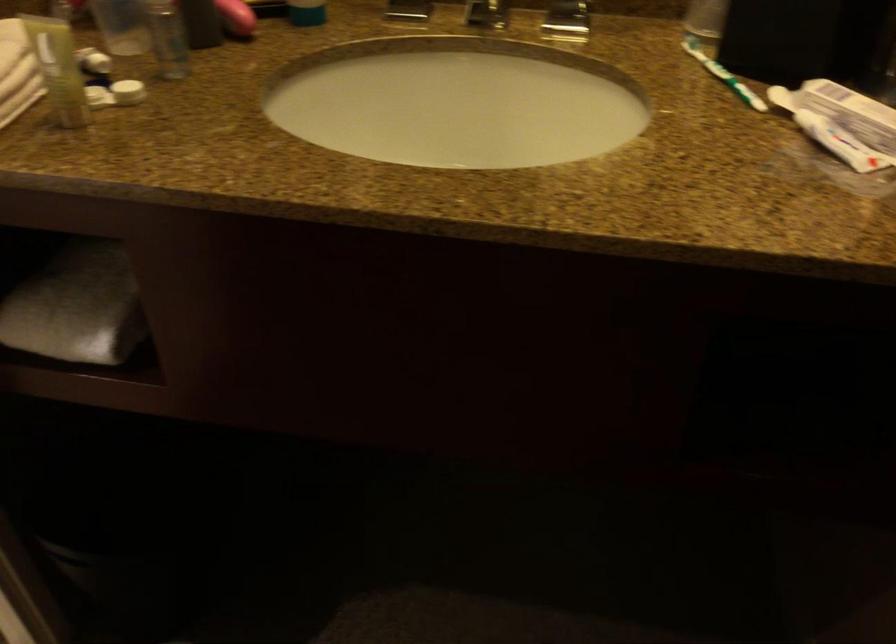
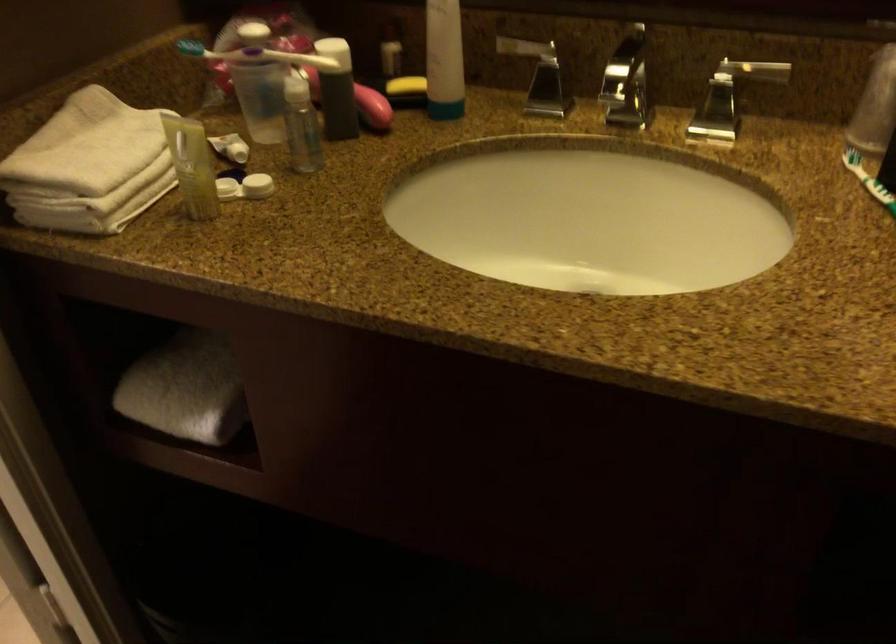
The point at [115,93] is marked in the first image. Where is the corresponding point in the second image?

(245, 187)